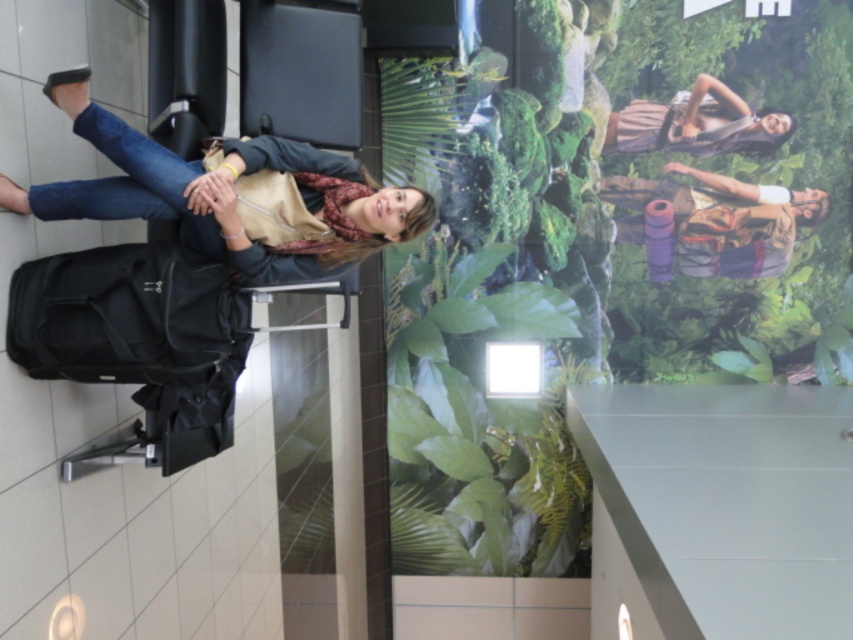
Looking at this image, is purple fabric backpack at upper right bigger than brown textured dress at upper right?

Yes, purple fabric backpack at upper right is bigger than brown textured dress at upper right.

Image resolution: width=853 pixels, height=640 pixels. I want to click on purple fabric backpack at upper right, so click(712, 221).

Which is behind, point (780, 214) or point (677, 140)?

The point (677, 140) is more distant.

Locate an element on the screen. The width and height of the screenshot is (853, 640). purple fabric backpack at upper right is located at coordinates (712, 221).

Does black fabric suitcase at lower left lie in front of brown textured dress at upper right?

Yes, it is.

Is black fabric suitcase at lower left above brown textured dress at upper right?

Incorrect, black fabric suitcase at lower left is not positioned above brown textured dress at upper right.

What do you see at coordinates (126, 316) in the screenshot?
I see `black fabric suitcase at lower left` at bounding box center [126, 316].

At what (x,y) coordinates should I click in order to perform the action: click on black fabric suitcase at lower left. Please return your answer as a coordinate pair (x, y). The width and height of the screenshot is (853, 640). Looking at the image, I should click on (126, 316).

Which is above, black fabric suitcase at lower left or purple fabric backpack at upper right?

purple fabric backpack at upper right is above.

Is point (169, 380) closer to viewer compared to point (621, 202)?

Yes, it is.

Image resolution: width=853 pixels, height=640 pixels. Identify the location of black fabric suitcase at lower left. (126, 316).